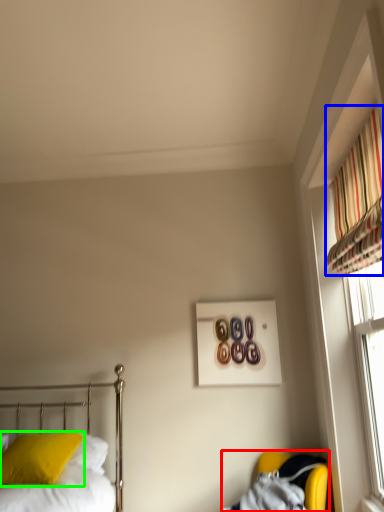
Question: Based on their relative distances, which object is farther from armchair (highlighted by a red box)? Choose from curtain (highlighted by a blue box) and pillow (highlighted by a green box).

Choices:
 (A) curtain
 (B) pillow

Answer: (A)